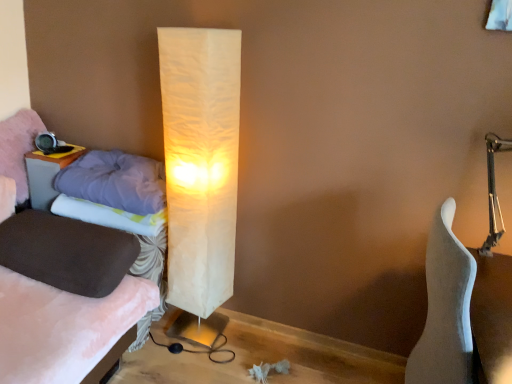
Identify the location of vacant area on top of matte wood table at left (from a real-world perspective). The image size is (512, 384). (58, 151).